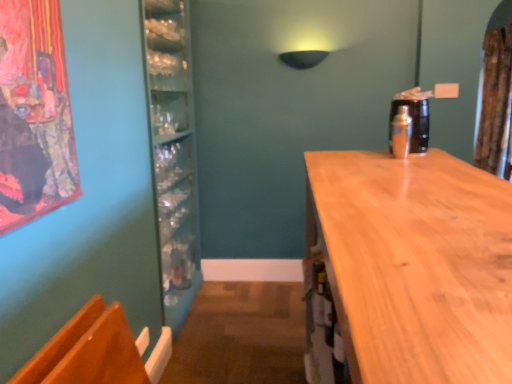
Measure the distance between point (493, 227) and camera.

Point (493, 227) is 33.94 inches from camera.

Where is `light brown wood countertop at right`? Image resolution: width=512 pixels, height=384 pixels. light brown wood countertop at right is located at coordinates point(414,264).

What do you see at coordinates (88, 351) in the screenshot? I see `wooden armchair at lower left` at bounding box center [88, 351].

In order to face brown textured curtain at upper right, should I rotate leftwards or rightwards?

Turn right by 29.008 degrees to look at brown textured curtain at upper right.

This screenshot has height=384, width=512. Find the location of `light brown wood countertop at right`. light brown wood countertop at right is located at coordinates (414, 264).

From a real-world perspective, does shiny metallic shaker at right sit lower than wooden armchair at lower left?

No.

Does shiny metallic shaker at right have a lesser width compared to wooden armchair at lower left?

Indeed, shiny metallic shaker at right has a lesser width compared to wooden armchair at lower left.

Does shiny metallic shaker at right touch wooden armchair at lower left?

No.

Is shiny metallic shaker at right facing away from wooden armchair at lower left?

No, shiny metallic shaker at right is not facing away from wooden armchair at lower left.

Is shiny metallic shaker at right to the left of brown textured curtain at upper right from the viewer's perspective?

Indeed, shiny metallic shaker at right is positioned on the left side of brown textured curtain at upper right.

Is shiny metallic shaker at right taller than brown textured curtain at upper right?

No, shiny metallic shaker at right is not taller than brown textured curtain at upper right.

From the image's perspective, is shiny metallic shaker at right on top of brown textured curtain at upper right?

No, from the image's perspective, shiny metallic shaker at right is not over brown textured curtain at upper right.

Is light brown wood countertop at right positioned behind brown textured curtain at upper right?

That is False.

Can you confirm if light brown wood countertop at right is taller than brown textured curtain at upper right?

In fact, light brown wood countertop at right may be shorter than brown textured curtain at upper right.

Is light brown wood countertop at right next to brown textured curtain at upper right and touching it?

light brown wood countertop at right and brown textured curtain at upper right are not in contact.

From a real-world perspective, is light brown wood countertop at right positioned over brown textured curtain at upper right based on gravity?

Incorrect, from a real-world perspective, light brown wood countertop at right is lower than brown textured curtain at upper right.

Who is bigger, wooden armchair at lower left or shiny metallic shaker at right?

Bigger between the two is wooden armchair at lower left.

You are a GUI agent. You are given a task and a screenshot of the screen. Output one action in this format:
    pyautogui.click(x=<x>, y=<y>)
    Task: Click on the bottle lying behind the wooden armchair at lower left
    Image resolution: width=512 pixels, height=384 pixels.
    Given the screenshot: What is the action you would take?
    pyautogui.click(x=401, y=132)

Is point (128, 339) positioned in front of point (402, 109)?

Yes, it is in front of point (402, 109).

Considering the relative sizes of wooden armchair at lower left and shiny metallic shaker at right in the image provided, is wooden armchair at lower left thinner than shiny metallic shaker at right?

Incorrect, the width of wooden armchair at lower left is not less than that of shiny metallic shaker at right.

Is wooden armchair at lower left turned away from light brown wood countertop at right?

No, wooden armchair at lower left is not facing away from light brown wood countertop at right.

In terms of size, does wooden armchair at lower left appear bigger or smaller than light brown wood countertop at right?

wooden armchair at lower left is smaller than light brown wood countertop at right.

Which object is closer to the camera taking this photo, wooden armchair at lower left or light brown wood countertop at right?

light brown wood countertop at right is in front.

From the image's perspective, is wooden armchair at lower left located above or below light brown wood countertop at right?

wooden armchair at lower left is situated lower than light brown wood countertop at right in the image.

Which of these two, wooden armchair at lower left or brown textured curtain at upper right, is smaller?

With smaller size is wooden armchair at lower left.

Considering the points (82, 326) and (489, 87), which point is in front, point (82, 326) or point (489, 87)?

The point (82, 326) is closer.

In terms of width, does wooden armchair at lower left look wider or thinner when compared to brown textured curtain at upper right?

In the image, wooden armchair at lower left appears to be more narrow than brown textured curtain at upper right.

From a real-world perspective, is wooden armchair at lower left above or below brown textured curtain at upper right?

In terms of real-world spatial position, wooden armchair at lower left is below brown textured curtain at upper right.

Between point (490, 75) and point (401, 279), which one is positioned behind?

The point (490, 75) is farther.

Between brown textured curtain at upper right and light brown wood countertop at right, which one has more height?

With more height is brown textured curtain at upper right.

This screenshot has width=512, height=384. In order to click on curtain above the light brown wood countertop at right (from the image's perspective) in this screenshot , I will do `click(494, 100)`.

Is brown textured curtain at upper right turned away from light brown wood countertop at right?

No, light brown wood countertop at right is not at the back of brown textured curtain at upper right.

Identify the location of armchair on the left of shiny metallic shaker at right. Image resolution: width=512 pixels, height=384 pixels. (88, 351).

In the image, there is a shiny metallic shaker at right. At what (x,y) coordinates should I click in order to perform the action: click on curtain above it (from the image's perspective). Please return your answer as a coordinate pair (x, y). This screenshot has height=384, width=512. Looking at the image, I should click on tap(494, 100).

Consider the image. Estimate the real-world distances between objects in this image. Which object is further from brown textured curtain at upper right, light brown wood countertop at right or shiny metallic shaker at right?

The object further to brown textured curtain at upper right is light brown wood countertop at right.

Estimate the real-world distances between objects in this image. Which object is further from wooden armchair at lower left, light brown wood countertop at right or shiny metallic shaker at right?

shiny metallic shaker at right lies further to wooden armchair at lower left than the other object.

From the image, which object appears to be nearer to light brown wood countertop at right, wooden armchair at lower left or shiny metallic shaker at right?

shiny metallic shaker at right is closer to light brown wood countertop at right.

Looking at the image, which one is located further to shiny metallic shaker at right, light brown wood countertop at right or brown textured curtain at upper right?

Based on the image, brown textured curtain at upper right appears to be further to shiny metallic shaker at right.

Estimate the real-world distances between objects in this image. Which object is closer to brown textured curtain at upper right, wooden armchair at lower left or light brown wood countertop at right?

light brown wood countertop at right is closer to brown textured curtain at upper right.

From the image, which object appears to be nearer to light brown wood countertop at right, wooden armchair at lower left or brown textured curtain at upper right?

wooden armchair at lower left lies closer to light brown wood countertop at right than the other object.

Based on their spatial positions, is shiny metallic shaker at right or brown textured curtain at upper right further from light brown wood countertop at right?

Based on the image, brown textured curtain at upper right appears to be further to light brown wood countertop at right.

Which object lies nearer to the anchor point wooden armchair at lower left, shiny metallic shaker at right or light brown wood countertop at right?

Based on the image, light brown wood countertop at right appears to be nearer to wooden armchair at lower left.

Find the location of a particular element. The width and height of the screenshot is (512, 384). armchair between light brown wood countertop at right and brown textured curtain at upper right along the z-axis is located at coordinates (88, 351).

Identify the location of armchair located between light brown wood countertop at right and shiny metallic shaker at right in the depth direction. The height and width of the screenshot is (384, 512). (88, 351).

Locate an element on the screen. The image size is (512, 384). bottle between wooden armchair at lower left and brown textured curtain at upper right from front to back is located at coordinates (401, 132).

Identify the location of bottle between light brown wood countertop at right and brown textured curtain at upper right along the z-axis. The height and width of the screenshot is (384, 512). (401, 132).